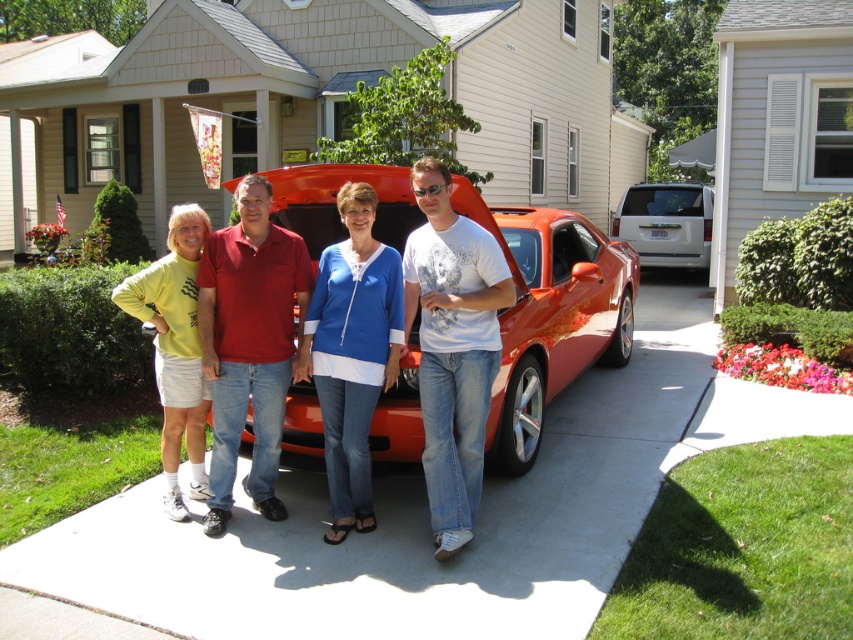
You are a photographer trying to capture a clear shot of the blue denim jeans at center and the white glossy minivan at center. Based on their heights, which object should you focus on first to ensure it is fully in frame?

The blue denim jeans at center is taller than the white glossy minivan at center, so you should focus on the blue denim jeans at center first to ensure it is fully in frame.